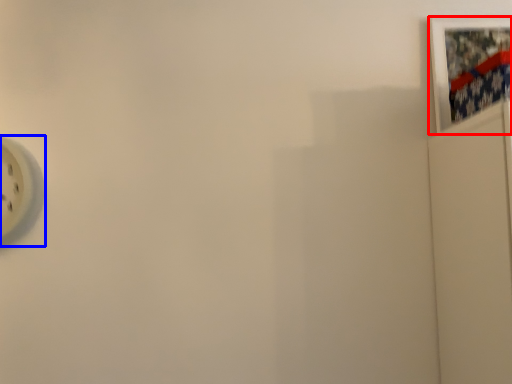
Question: Among these objects, which one is farthest to the camera, picture frame (highlighted by a red box) or wall clock (highlighted by a blue box)?

Choices:
 (A) picture frame
 (B) wall clock

Answer: (A)